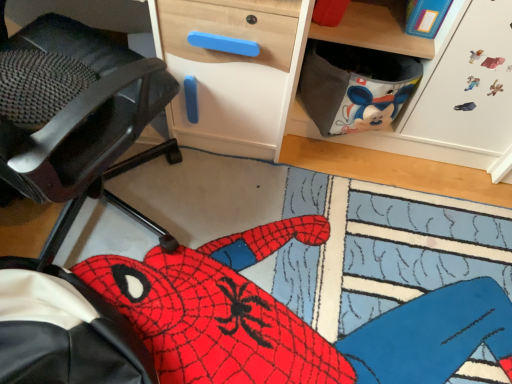
Question: From the image's perspective, is red plush spider at lower left positioned above or below wooden desk at upper right?

Choices:
 (A) below
 (B) above

Answer: (A)

Question: Based on their positions, is red plush spider at lower left located to the left or right of wooden desk at upper right?

Choices:
 (A) left
 (B) right

Answer: (A)

Question: Estimate the real-world distances between objects in this image. Which object is farther from the red plush spider at lower left?

Choices:
 (A) wooden desk at upper right
 (B) black mesh chair at left

Answer: (B)

Question: Estimate the real-world distances between objects in this image. Which object is closer to the red plush spider at lower left?

Choices:
 (A) black mesh chair at left
 (B) wooden desk at upper right

Answer: (B)